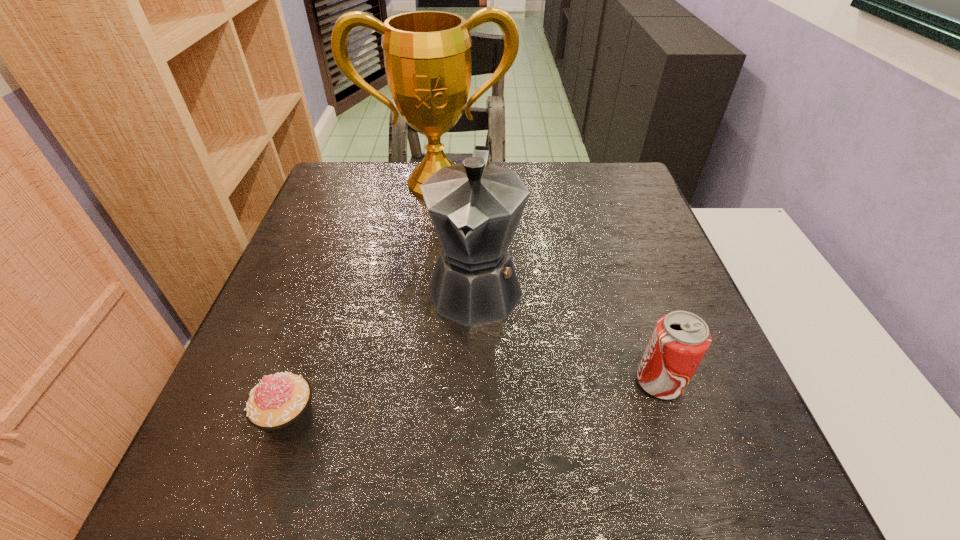
Point out which object is positioned as the nearest to the second tallest object. Please provide its 2D coordinates. Your answer should be formatted as a tuple, i.e. [(x, y)], where the tuple contains the x and y coordinates of a point satisfying the conditions above.

[(427, 56)]

Locate an element on the screen. The height and width of the screenshot is (540, 960). free point that satisfies the following two spatial constraints: 1. on the back side of the tallest object; 2. on the left side of the shortest object is located at coordinates (370, 184).

The image size is (960, 540). I want to click on vacant space that satisfies the following two spatial constraints: 1. on the front side of the rightmost object; 2. on the right side of the third shortest object, so click(474, 382).

Identify the location of free spot that satisfies the following two spatial constraints: 1. on the front side of the second farthest object; 2. on the left side of the farthest object. The width and height of the screenshot is (960, 540). (x=424, y=286).